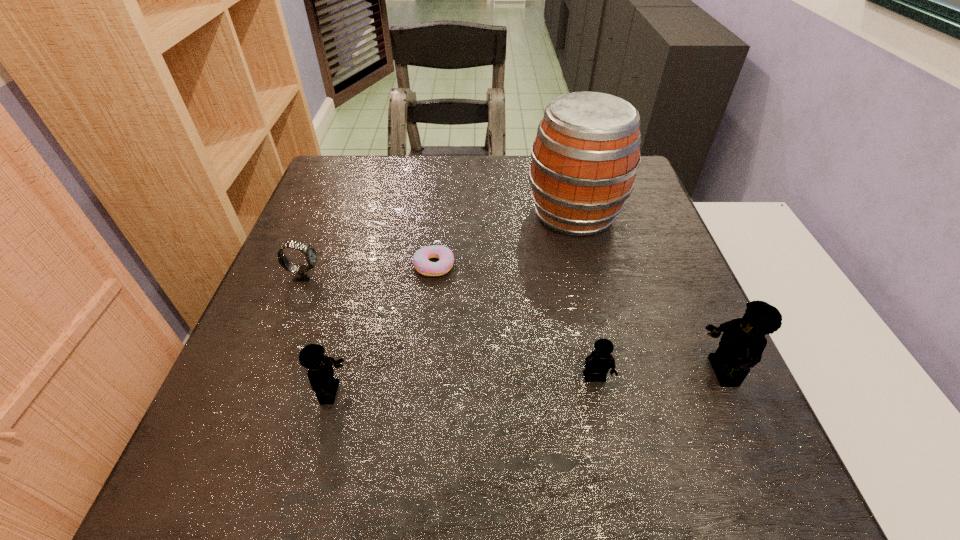
The image size is (960, 540). Identify the location of free space located on the front-facing side of the leftmost Lego. pos(420,393).

Where is `vacant space positioned 0.060m on the front-facing side of the second Lego from left to right`? vacant space positioned 0.060m on the front-facing side of the second Lego from left to right is located at coordinates (604, 420).

Locate an element on the screen. The width and height of the screenshot is (960, 540). blank area located 0.190m on the front-facing side of the fifth shortest object is located at coordinates (597, 371).

Identify the location of blank area located 0.380m on the front-facing side of the fifth shortest object. The image size is (960, 540). (493, 371).

You are a GUI agent. You are given a task and a screenshot of the screen. Output one action in this format:
    pyautogui.click(x=<x>, y=<y>)
    Task: Click on the vacant space situated on the front-facing side of the fifth shortest object
    This screenshot has height=540, width=960.
    Given the screenshot: What is the action you would take?
    pyautogui.click(x=526, y=371)

The height and width of the screenshot is (540, 960). What are the coordinates of `vacant space located 0.100m on the right of the third object from left to right` in the screenshot? It's located at [498, 266].

Where is `vacant space located on the front of the farthest object`? This screenshot has height=540, width=960. vacant space located on the front of the farthest object is located at coordinates pos(592,288).

This screenshot has height=540, width=960. I want to click on vacant area situated 0.390m on the face of the leftmost object, so click(x=497, y=275).

Identify the location of object present at the far edge. (584, 160).

Locate an element on the screen. The width and height of the screenshot is (960, 540). Lego present at the left edge is located at coordinates (320, 372).